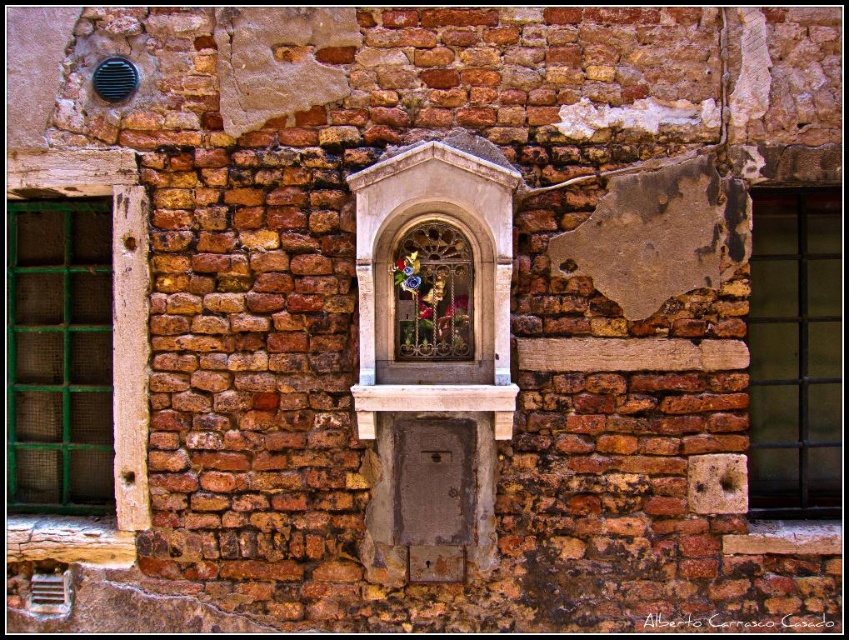
Question: Does green mesh window at left appear on the left side of black metal window at right?

Choices:
 (A) yes
 (B) no

Answer: (A)

Question: Does green mesh window at left appear on the left side of black metal window at right?

Choices:
 (A) no
 (B) yes

Answer: (B)

Question: Which object is farther from the camera taking this photo?

Choices:
 (A) black metal window at right
 (B) green mesh window at left

Answer: (B)

Question: Which of the following is the closest to the observer?

Choices:
 (A) (802, 332)
 (B) (48, 477)

Answer: (A)

Question: Is the position of green mesh window at left less distant than that of black metal window at right?

Choices:
 (A) yes
 (B) no

Answer: (B)

Question: Which point is closer to the camera taking this photo?

Choices:
 (A) (41, 385)
 (B) (776, 416)

Answer: (B)